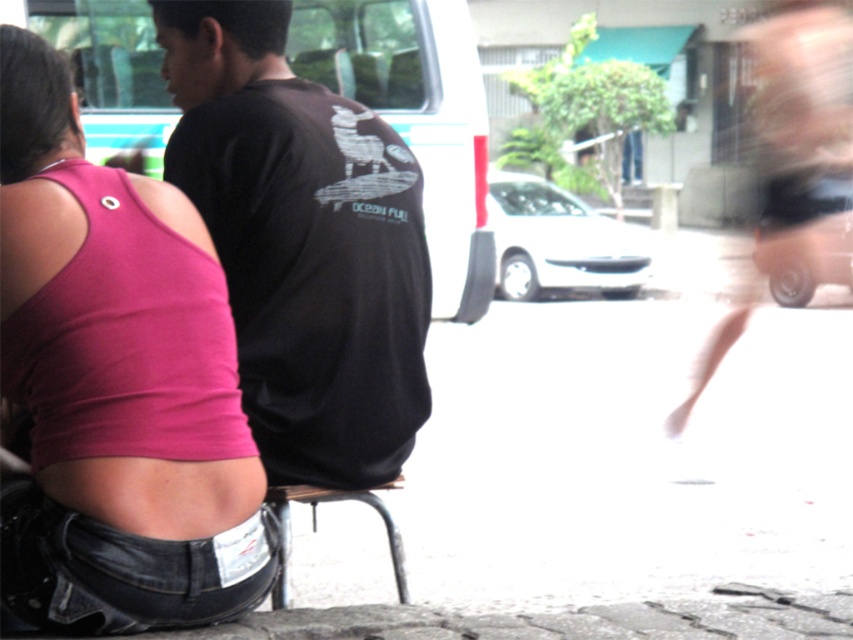
You are a photographer trying to capture a closeup of the pink fabric tank top at upper left. Based on its 2D coordinates, where should you position your camera to ensure it is centered in the frame?

The pink fabric tank top at upper left is located at coordinates point (115, 381), so to center it in the frame, the camera should be positioned so that the center of the viewfinder aligns with those coordinates.